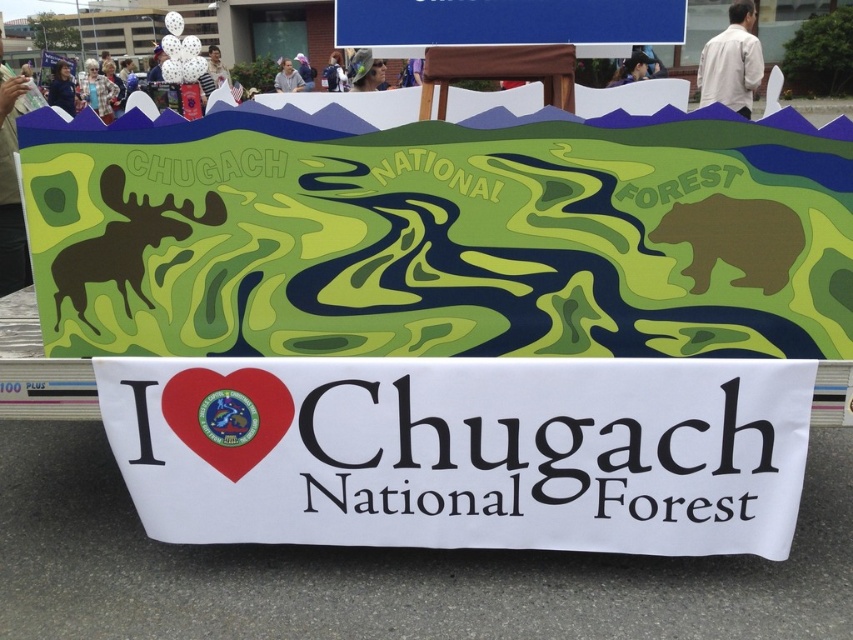
You are looking at the Chugach National Forest banner. There is a black matte moose at left and a matte black shirt at upper left. Which object is positioned closer to you?

The black matte moose at left is closer to the viewer than the matte black shirt at upper left.

You are designing a new logo for the Chugach National Forest banner. The logo must include both the black matte moose at left and the matte black shirt at upper left. Based on their current positions, which object should be placed to the left in the logo design?

The matte black shirt at upper left should be placed to the left in the logo design since the black matte moose at left is positioned on its right side in the current banner.